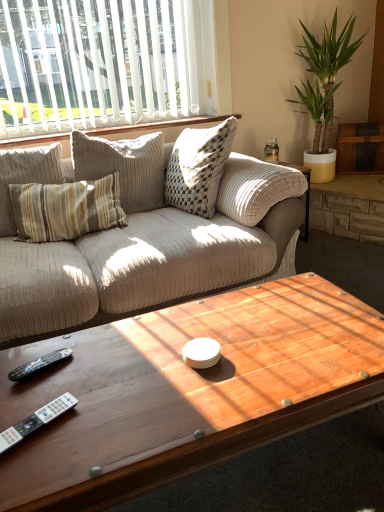
Where is `free space in front of white plastic remote at lower left`? The width and height of the screenshot is (384, 512). free space in front of white plastic remote at lower left is located at coordinates (31, 471).